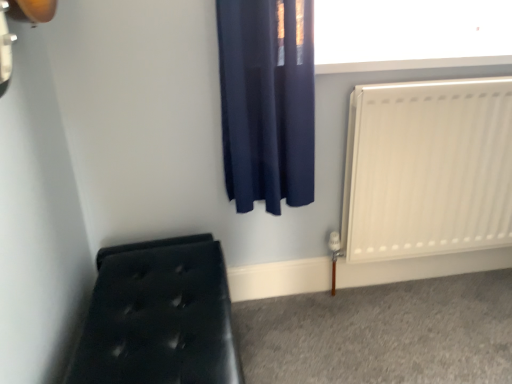
Locate an element on the screen. This screenshot has width=512, height=384. vacant space underneath white matte radiator at right (from a real-world perspective) is located at coordinates (432, 287).